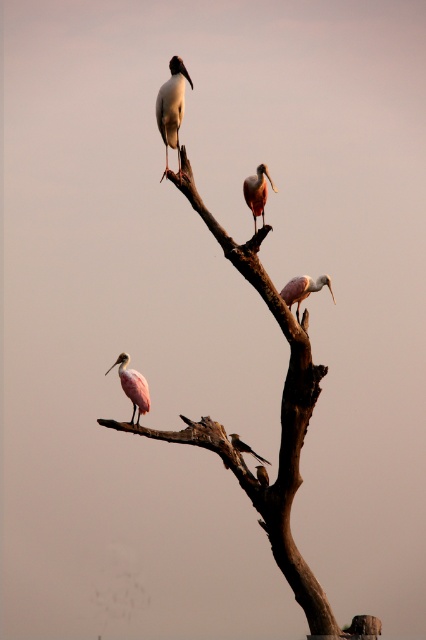
Question: Considering the real-world distances, which object is closest to the brown rough tree trunk at center?

Choices:
 (A) pink feathered spoonbill at center
 (B) pink matte spoonbill at upper center

Answer: (A)

Question: Which object is closer to the camera taking this photo?

Choices:
 (A) pink matte spoonbill at lower left
 (B) smooth pink spoonbill at lower center
 (C) pink feathered spoonbill at center

Answer: (B)

Question: Is brown rough tree trunk at center below smooth pink spoonbill at lower center?

Choices:
 (A) no
 (B) yes

Answer: (A)

Question: Can you confirm if white glossy stork at upper center is positioned below smooth pink spoonbill at lower center?

Choices:
 (A) yes
 (B) no

Answer: (B)

Question: Does pink matte spoonbill at lower left appear on the right side of pink feathered bird at lower center?

Choices:
 (A) yes
 (B) no

Answer: (B)

Question: Which point is closer to the camera?

Choices:
 (A) white glossy stork at upper center
 (B) pink feathered bird at lower center

Answer: (A)